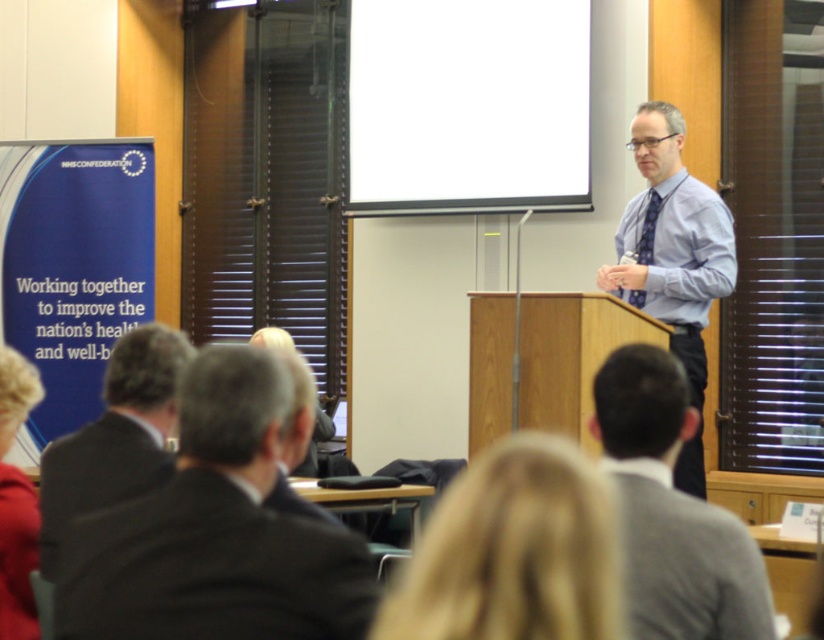
You are standing in the conference room and want to move from point A to point B. Point A is located at coordinate point A which is point (640, 172) and point B is at point (665, 262). Given that point A is closer to you than point B, can you walk directly from point A to point B without any obstacles?

Point A is closer to you than point B, so you can walk directly from point A to point B without any obstacles since there are no mentioned obstacles in the scene description.

You are sitting in the conference room and want to determine which of the two points, point (517, 480) or point (734, 259), is closer to you. Based on the scene description, which point is nearer?

Point (517, 480) is closer to the viewer than point (734, 259).

You are standing in the conference room and want to take a photo of the point at coordinates [666,280]. The camera you are using has a maximum focus range of 5 meters. Will the camera be able to focus on the point?

The point at coordinates [666,280] is 4.80 meters from the camera, which is within the 5 meter focus range. Therefore, the camera should be able to focus on the point.